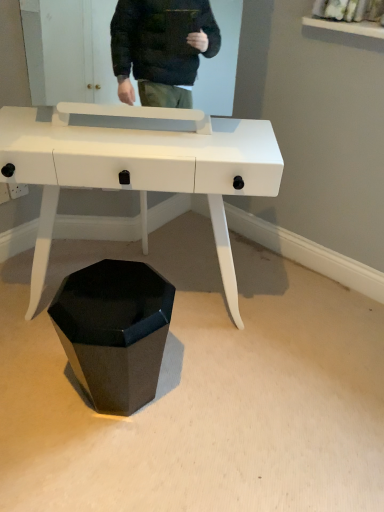
Identify the location of free point below white glossy desk at center (from a real-world perspective). (193, 320).